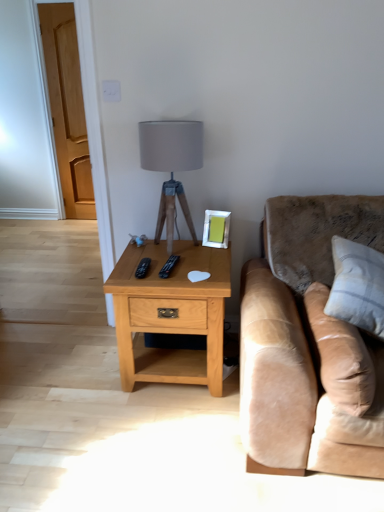
Question: From the image's perspective, is suede beige couch at right above or below beige leather pillow at right, arranged as the 2th pillow when viewed from the right?

Choices:
 (A) below
 (B) above

Answer: (B)

Question: Based on their positions, is suede beige couch at right located to the left or right of beige leather pillow at right, which is the first pillow in left-to-right order?

Choices:
 (A) right
 (B) left

Answer: (A)

Question: Based on their relative distances, which object is nearer to the beige leather pillow at right, arranged as the 2th pillow when viewed from the right?

Choices:
 (A) black plastic remote at center
 (B) white cotton pillow at right, which is the second pillow in left-to-right order
 (C) suede beige couch at right
 (D) light oak wood nightstand at center
 (E) matte gray fabric lampshade at center

Answer: (C)

Question: Estimate the real-world distances between objects in this image. Which object is farther from the suede beige couch at right?

Choices:
 (A) light oak wood nightstand at center
 (B) white cotton pillow at right, which is the second pillow in left-to-right order
 (C) black plastic remote at center
 (D) matte gray fabric lampshade at center
 (E) silver metallic picture frame at upper right

Answer: (D)